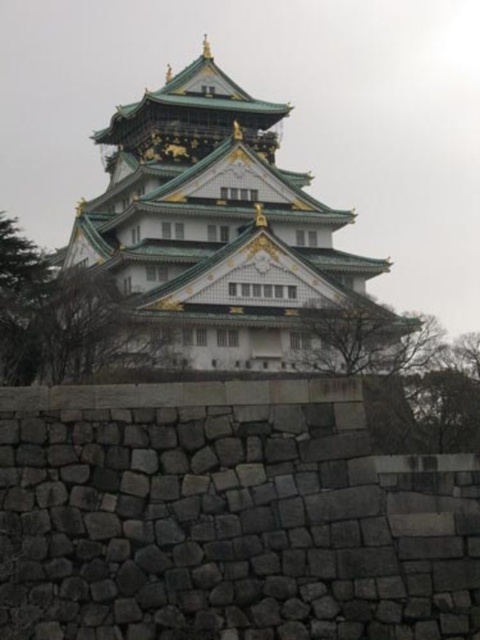
You are standing in front of Osaka Castle and want to take a photo that includes both the point at coordinates point (207, 442) and point (303, 323). Which point should you focus on to ensure both are in sharp focus?

You should focus on point (303, 323) because it is farther from the camera than point (207, 442). By focusing on the farther point, both points will be within the depth of field and appear sharp in the photo.

You are a tourist standing in front of Osaka Castle. You notice the gray stone wall at lower center and the green glazed tile tower at center. Which of these two objects takes up more visual space in the image?

The green glazed tile tower at center occupies more visual space than the gray stone wall at lower center according to the description.